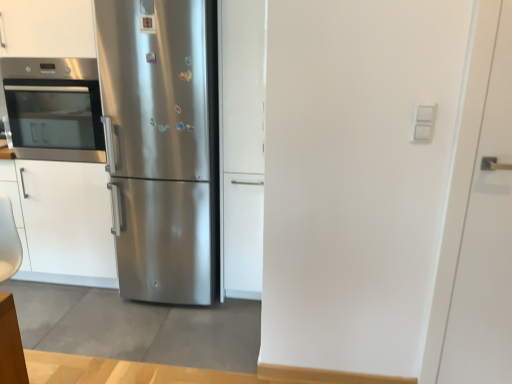
Question: From a real-world perspective, is stainless steel refrigerator at center physically below satin white cabinet at center, which is the 1th door in left-to-right order?

Choices:
 (A) no
 (B) yes

Answer: (B)

Question: Is stainless steel refrigerator at center to the right of satin white cabinet at center, marked as the 2th door in a right-to-left arrangement, from the viewer's perspective?

Choices:
 (A) yes
 (B) no

Answer: (B)

Question: Is stainless steel refrigerator at center to the left of satin white cabinet at center, the 2th door viewed from the front, from the viewer's perspective?

Choices:
 (A) yes
 (B) no

Answer: (A)

Question: Is satin white cabinet at center, the first door positioned from the back, at the back of stainless steel refrigerator at center?

Choices:
 (A) no
 (B) yes

Answer: (A)

Question: Is there a large distance between stainless steel refrigerator at center and satin white cabinet at center, the first door positioned from the back?

Choices:
 (A) yes
 (B) no

Answer: (B)

Question: Is stainless steel refrigerator at center bigger than satin white cabinet at center, the first door positioned from the back?

Choices:
 (A) no
 (B) yes

Answer: (B)

Question: Is stainless steel refrigerator at center bigger than stainless steel oven at left?

Choices:
 (A) no
 (B) yes

Answer: (B)

Question: From a real-world perspective, is stainless steel refrigerator at center located beneath stainless steel oven at left?

Choices:
 (A) no
 (B) yes

Answer: (B)

Question: Does stainless steel refrigerator at center turn towards stainless steel oven at left?

Choices:
 (A) no
 (B) yes

Answer: (A)

Question: Is stainless steel refrigerator at center at the right side of stainless steel oven at left?

Choices:
 (A) yes
 (B) no

Answer: (A)

Question: Does stainless steel refrigerator at center have a smaller size compared to stainless steel oven at left?

Choices:
 (A) no
 (B) yes

Answer: (A)

Question: Is stainless steel refrigerator at center wider than stainless steel oven at left?

Choices:
 (A) yes
 (B) no

Answer: (A)

Question: From the image's perspective, is stainless steel refrigerator at center located beneath white matte door at right, which is the 1th door in right-to-left order?

Choices:
 (A) yes
 (B) no

Answer: (B)